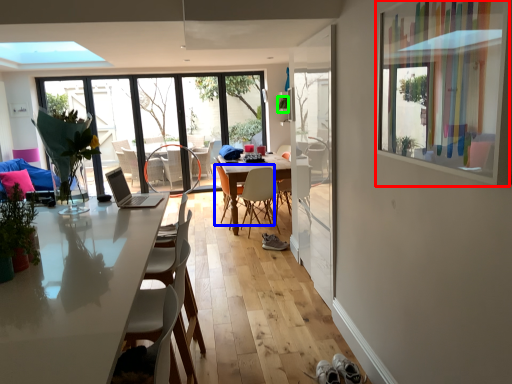
Question: Based on their relative distances, which object is farther from window screen (highlighted by a red box)? Choose from chair (highlighted by a blue box) and plant (highlighted by a green box).

Choices:
 (A) chair
 (B) plant

Answer: (B)